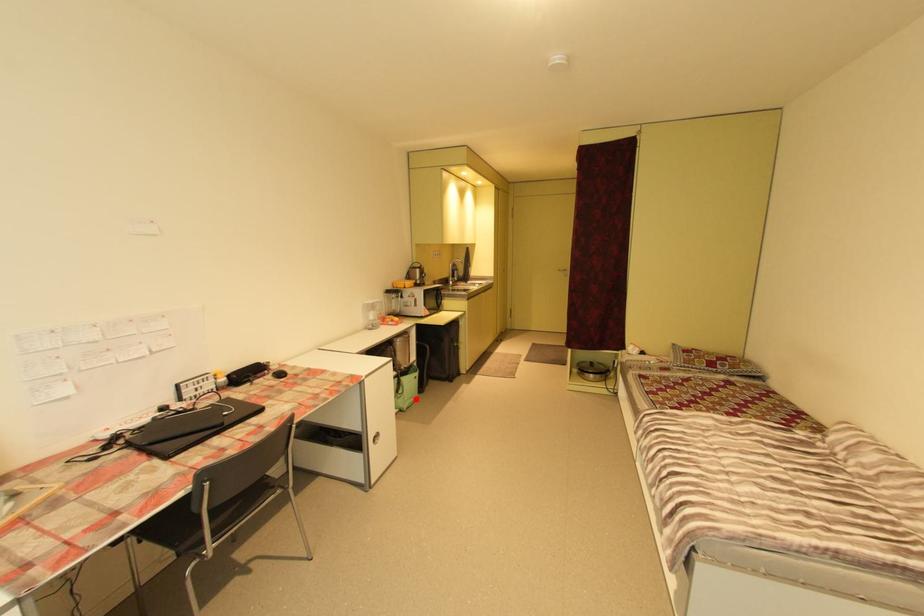
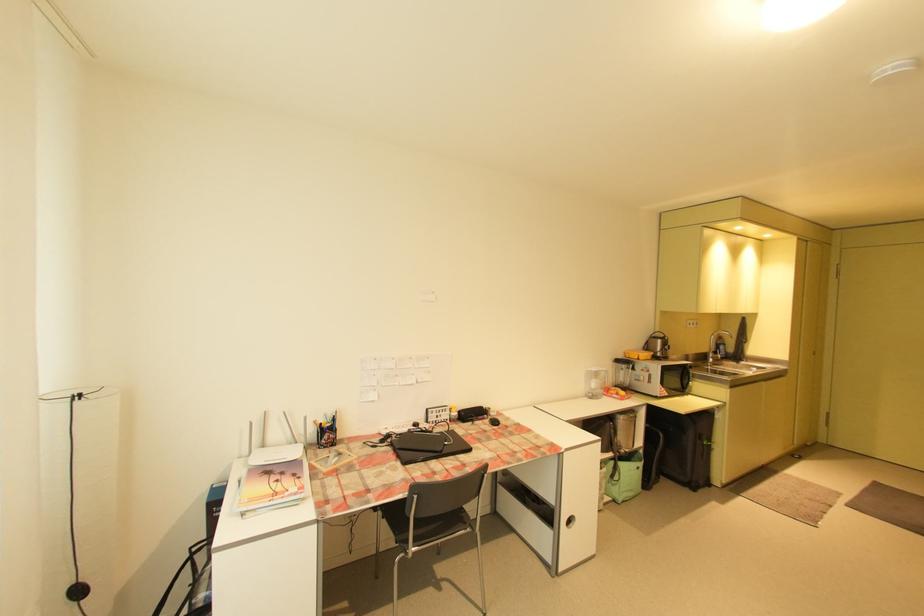
Question: I am providing you with two images of the same scene from different viewpoints. A red point is marked on the first image. At the location where the point appears in image 1, is it still visible in image 2?

Choices:
 (A) Yes
 (B) No

Answer: (A)